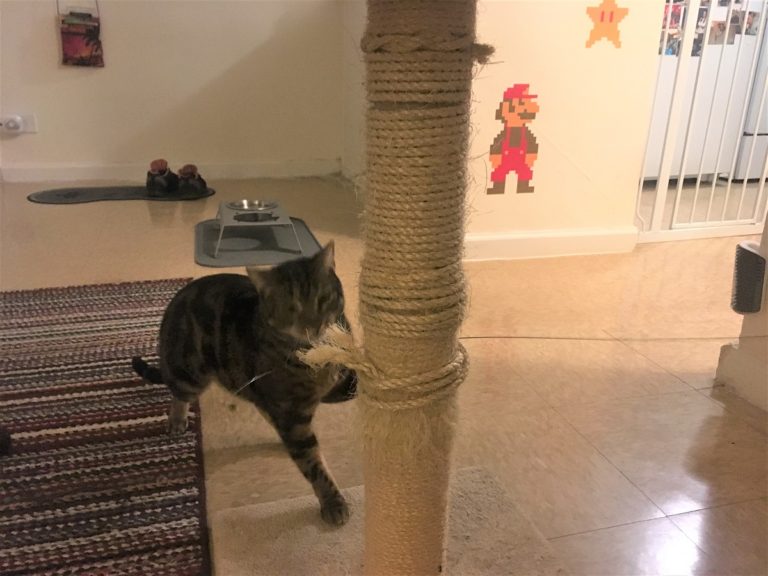
Identify the location of fridge. (704, 98).